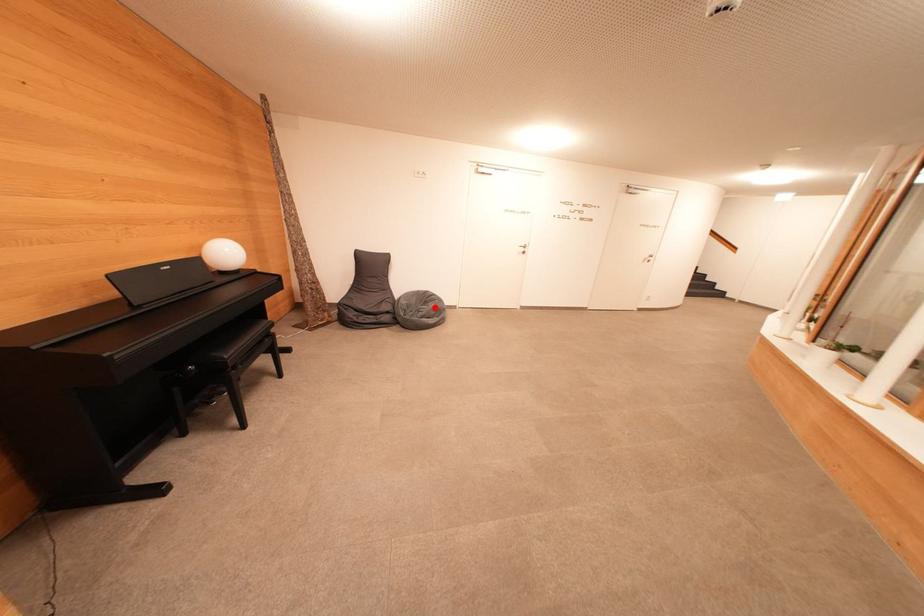
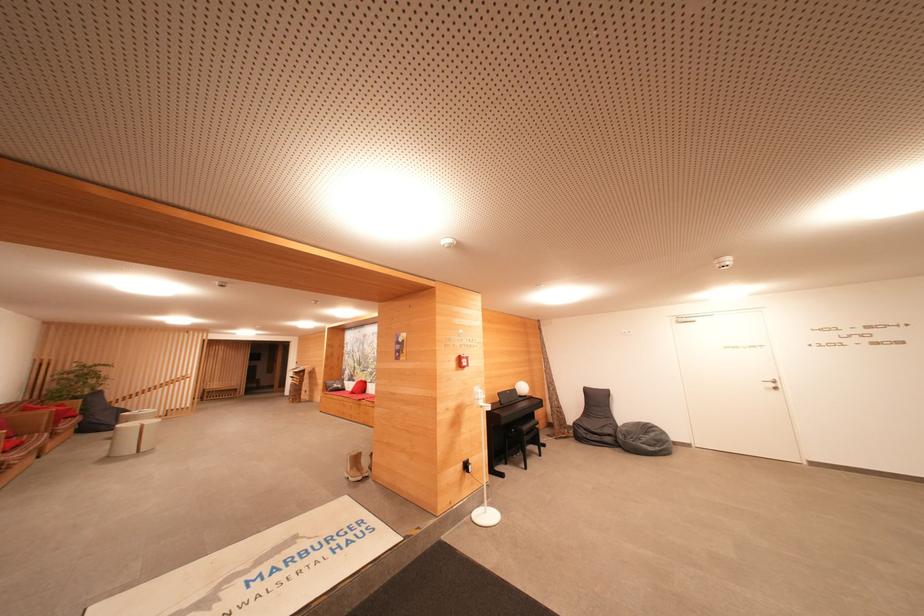
Where in the second image is the point corresponding to the highlighted location from the first image?

(655, 438)